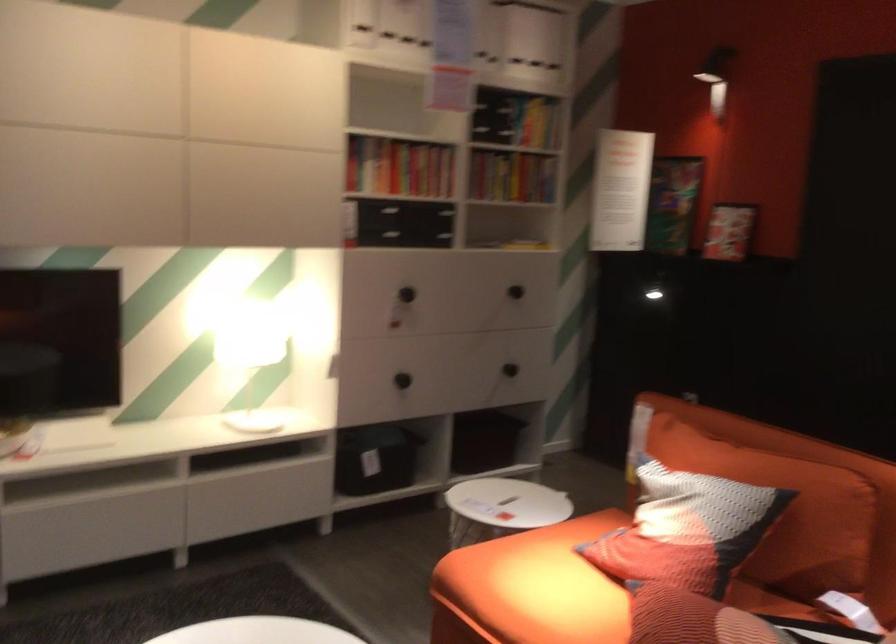
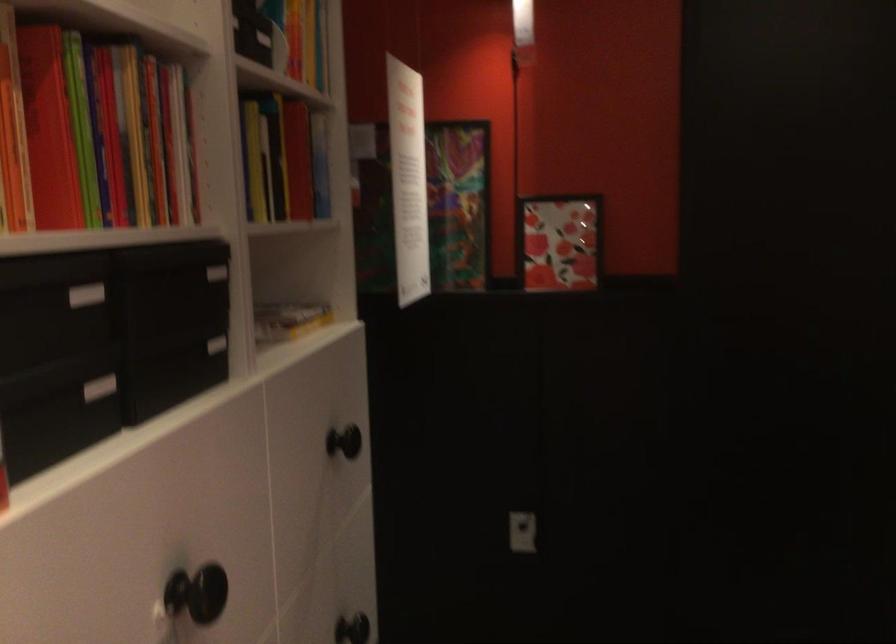
In the second image, find the point that corresponds to pixel 400 218 in the first image.

(99, 388)